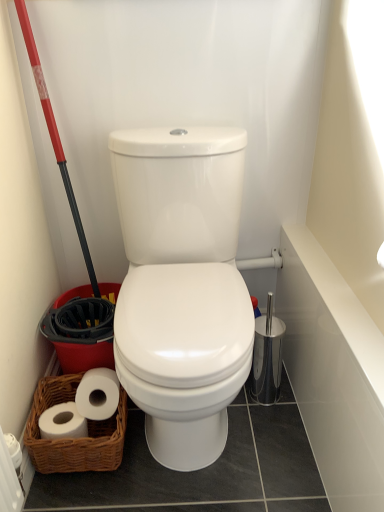
Question: Is the depth of white glossy bath at upper right greater than that of red plastic shovel at left?

Choices:
 (A) yes
 (B) no

Answer: (B)

Question: From a real-world perspective, is white glossy bath at upper right located beneath red plastic shovel at left?

Choices:
 (A) no
 (B) yes

Answer: (B)

Question: Is white glossy bath at upper right to the left of red plastic shovel at left from the viewer's perspective?

Choices:
 (A) no
 (B) yes

Answer: (A)

Question: Is white glossy bath at upper right in contact with red plastic shovel at left?

Choices:
 (A) yes
 (B) no

Answer: (B)

Question: Does white glossy bath at upper right have a larger size compared to red plastic shovel at left?

Choices:
 (A) no
 (B) yes

Answer: (A)

Question: Is point (102, 318) closer or farther from the camera than point (48, 458)?

Choices:
 (A) farther
 (B) closer

Answer: (A)

Question: Is red plastic shovel at left in front of or behind woven brown basket at lower left in the image?

Choices:
 (A) behind
 (B) front

Answer: (B)

Question: Do you think red plastic shovel at left is within woven brown basket at lower left, or outside of it?

Choices:
 (A) inside
 (B) outside

Answer: (B)

Question: From a real-world perspective, relative to woven brown basket at lower left, is red plastic shovel at left vertically above or below?

Choices:
 (A) above
 (B) below

Answer: (A)

Question: Considering the positions of woven brown basket at lower left and white glossy bath at upper right in the image, is woven brown basket at lower left bigger or smaller than white glossy bath at upper right?

Choices:
 (A) small
 (B) big

Answer: (B)

Question: Considering the positions of woven brown basket at lower left and white glossy bath at upper right in the image, is woven brown basket at lower left wider or thinner than white glossy bath at upper right?

Choices:
 (A) wide
 (B) thin

Answer: (A)

Question: Would you say woven brown basket at lower left is inside or outside white glossy bath at upper right?

Choices:
 (A) inside
 (B) outside

Answer: (B)

Question: From the image's perspective, is woven brown basket at lower left above or below white glossy bath at upper right?

Choices:
 (A) above
 (B) below

Answer: (B)

Question: Based on their positions, is red plastic shovel at left located to the left or right of white glossy bath at upper right?

Choices:
 (A) left
 (B) right

Answer: (A)

Question: From a real-world perspective, is red plastic shovel at left physically located above or below white glossy bath at upper right?

Choices:
 (A) below
 (B) above

Answer: (B)